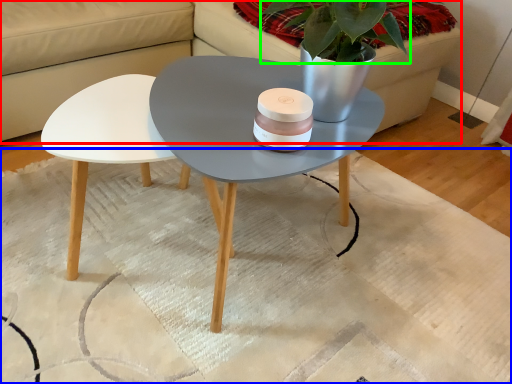
Question: Estimate the real-world distances between objects in this image. Which object is closer to couch (highlighted by a red box), mat (highlighted by a blue box) or plant (highlighted by a green box)?

Choices:
 (A) mat
 (B) plant

Answer: (A)